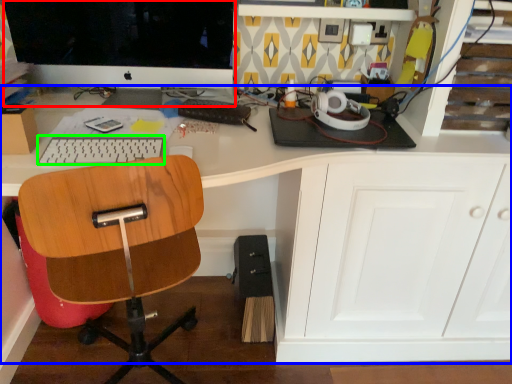
Question: Considering the real-world distances, which object is farthest from computer monitor (highlighted by a red box)? desk (highlighted by a blue box) or keyboard (highlighted by a green box)?

Choices:
 (A) desk
 (B) keyboard

Answer: (A)